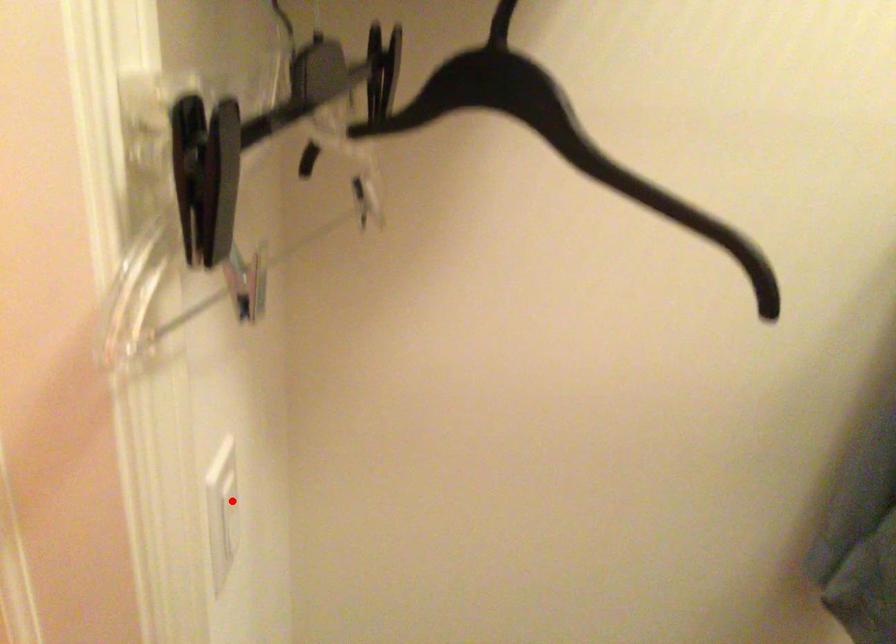
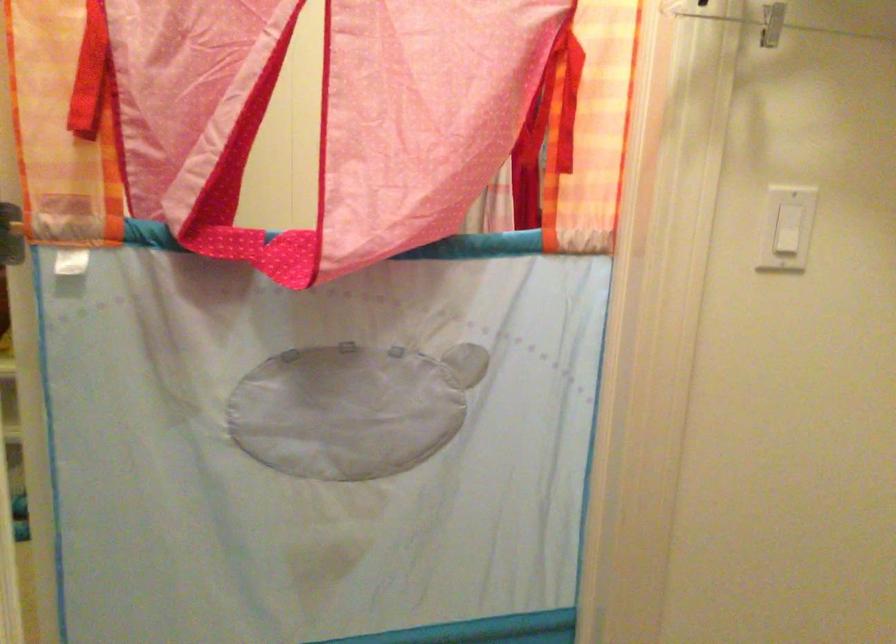
Question: A red point is marked in image1. In image2, is the corresponding 3D point closer to the camera or farther? Reply with the corresponding letter.

Choices:
 (A) The corresponding 3D point is closer.
 (B) The corresponding 3D point is farther.

Answer: (B)